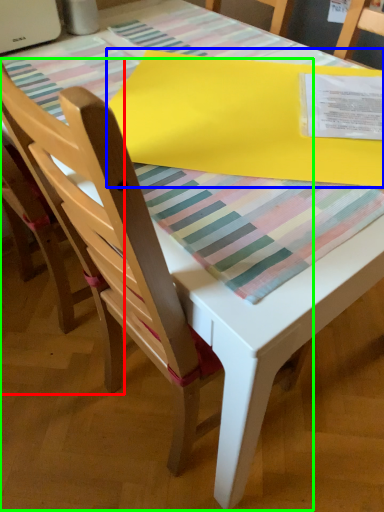
Question: Which object is the closest to the chair (highlighted by a red box)? Choose among these: blanket (highlighted by a blue box) or chair (highlighted by a green box).

Choices:
 (A) blanket
 (B) chair

Answer: (B)